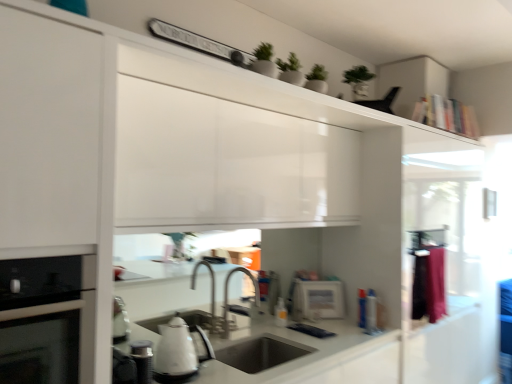
Question: Should I look upward or downward to see white glossy kettle at lower center?

Choices:
 (A) up
 (B) down

Answer: (B)

Question: From a real-world perspective, is silver metallic faucet at center under black glass oven at left?

Choices:
 (A) no
 (B) yes

Answer: (B)

Question: Is silver metallic faucet at center bigger than black glass oven at left?

Choices:
 (A) no
 (B) yes

Answer: (A)

Question: Can you confirm if silver metallic faucet at center is taller than black glass oven at left?

Choices:
 (A) yes
 (B) no

Answer: (B)

Question: Could you tell me if silver metallic faucet at center is facing black glass oven at left?

Choices:
 (A) yes
 (B) no

Answer: (B)

Question: Is silver metallic faucet at center surrounding black glass oven at left?

Choices:
 (A) yes
 (B) no

Answer: (B)

Question: Is the position of silver metallic faucet at center more distant than that of black glass oven at left?

Choices:
 (A) no
 (B) yes

Answer: (B)

Question: From a real-world perspective, is white glossy microwave at center, which is the 1th appliance in bottom-to-top order, on white glossy kettle at lower left, acting as the 1th appliance starting from the left?

Choices:
 (A) yes
 (B) no

Answer: (A)

Question: Is white glossy kettle at lower left, which ranks as the third appliance in right-to-left order, inside white glossy microwave at center, acting as the first appliance starting from the right?

Choices:
 (A) no
 (B) yes

Answer: (A)

Question: Would you say white glossy microwave at center, which ranks as the 3th appliance in left-to-right order, is outside white glossy kettle at lower left, which is the 3th appliance from back to front?

Choices:
 (A) no
 (B) yes

Answer: (B)

Question: Would you consider white glossy microwave at center, the 3th appliance positioned from the front, to be distant from white glossy kettle at lower left, which is the 2th appliance from top to bottom?

Choices:
 (A) no
 (B) yes

Answer: (B)

Question: Can you confirm if white glossy microwave at center, acting as the first appliance starting from the right, is positioned to the right of white glossy kettle at lower left, the 2th appliance positioned from the bottom?

Choices:
 (A) yes
 (B) no

Answer: (A)

Question: From the image's perspective, would you say white glossy microwave at center, which ranks as the 3th appliance in left-to-right order, is positioned over white glossy kettle at lower left, which ranks as the first appliance in front-to-back order?

Choices:
 (A) yes
 (B) no

Answer: (B)

Question: Does matte stainless steel sink at center have a lesser height compared to translucent plastic bottle at sink?

Choices:
 (A) yes
 (B) no

Answer: (B)